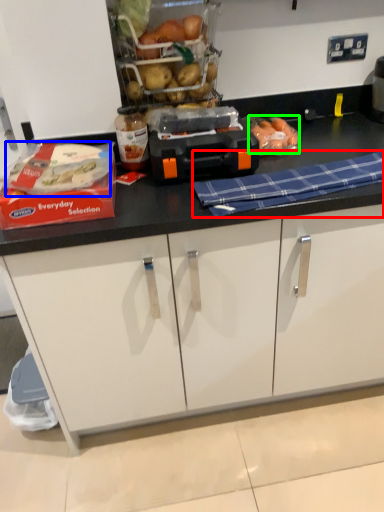
Question: Estimate the real-world distances between objects in this image. Which object is farther from blanket (highlighted by a red box), food (highlighted by a blue box) or food (highlighted by a green box)?

Choices:
 (A) food
 (B) food

Answer: (A)